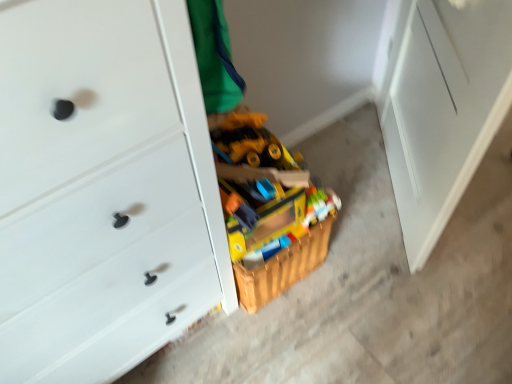
Find the location of a particular element. white matte chest of drawers at center is located at coordinates (103, 189).

This screenshot has width=512, height=384. I want to click on wooden toy box at center, so click(x=268, y=207).

At what (x,y) coordinates should I click in order to perform the action: click on toy below the white matte chest of drawers at center (from a real-world perspective). Please return your answer as a coordinate pair (x, y). Image resolution: width=512 pixels, height=384 pixels. Looking at the image, I should click on (268, 207).

From a real-world perspective, who is located higher, wooden toy box at center or white matte chest of drawers at center?

white matte chest of drawers at center, from a real-world perspective.

Which object is closer to the camera taking this photo, wooden toy box at center or white matte chest of drawers at center?

white matte chest of drawers at center is in front.

Considering the relative sizes of wooden toy box at center and white matte chest of drawers at center in the image provided, is wooden toy box at center shorter than white matte chest of drawers at center?

Indeed, wooden toy box at center has a lesser height compared to white matte chest of drawers at center.

Is white matte file cabinet at right a part of white matte chest of drawers at center?

Definitely not — white matte file cabinet at right is not inside white matte chest of drawers at center.

Between white matte chest of drawers at center and white matte file cabinet at right, which one has larger size?

white matte chest of drawers at center.

Is white matte chest of drawers at center thinner than white matte file cabinet at right?

No, white matte chest of drawers at center is not thinner than white matte file cabinet at right.

Considering the relative positions of white matte chest of drawers at center and white matte file cabinet at right in the image provided, is white matte chest of drawers at center in front of white matte file cabinet at right?

That is True.

How many degrees apart are the facing directions of white matte file cabinet at right and white matte chest of drawers at center?

They differ by 127 degrees in their facing directions.

From the image's perspective, is white matte file cabinet at right beneath white matte chest of drawers at center?

No, from the image's perspective, white matte file cabinet at right is not beneath white matte chest of drawers at center.

In terms of width, does white matte file cabinet at right look wider or thinner when compared to white matte chest of drawers at center?

Considering their sizes, white matte file cabinet at right looks slimmer than white matte chest of drawers at center.

Is white matte file cabinet at right taller or shorter than white matte chest of drawers at center?

Clearly, white matte file cabinet at right is shorter compared to white matte chest of drawers at center.

Does wooden toy box at center turn towards white matte file cabinet at right?

No, wooden toy box at center is not facing towards white matte file cabinet at right.

Which of these two, wooden toy box at center or white matte file cabinet at right, is thinner?

With smaller width is white matte file cabinet at right.

Would you say wooden toy box at center is inside or outside white matte file cabinet at right?

wooden toy box at center lies outside white matte file cabinet at right.

Which of these two, wooden toy box at center or white matte file cabinet at right, is smaller?

white matte file cabinet at right.

Consider the image. Is white matte file cabinet at right next to wooden toy box at center and touching it?

No, white matte file cabinet at right is not touching wooden toy box at center.

Considering the sizes of objects white matte file cabinet at right and wooden toy box at center in the image provided, who is shorter, white matte file cabinet at right or wooden toy box at center?

Standing shorter between the two is wooden toy box at center.

Where is `file cabinet on the right of wooden toy box at center`? Image resolution: width=512 pixels, height=384 pixels. file cabinet on the right of wooden toy box at center is located at coordinates (440, 105).

From the image's perspective, is white matte file cabinet at right positioned above or below wooden toy box at center?

Clearly, from the image's perspective, white matte file cabinet at right is above wooden toy box at center.

Which is in front, white matte chest of drawers at center or wooden toy box at center?

Positioned in front is white matte chest of drawers at center.

From the picture: From a real-world perspective, which object stands above the other?

From a 3D spatial view, white matte chest of drawers at center is above.

Is white matte chest of drawers at center smaller than wooden toy box at center?

Actually, white matte chest of drawers at center might be larger than wooden toy box at center.

Considering the positions of objects white matte chest of drawers at center and wooden toy box at center in the image provided, who is more to the right, white matte chest of drawers at center or wooden toy box at center?

From the viewer's perspective, wooden toy box at center appears more on the right side.

Find the location of a particular element. The width and height of the screenshot is (512, 384). toy below the white matte chest of drawers at center (from the image's perspective) is located at coordinates point(268,207).

The height and width of the screenshot is (384, 512). I want to click on file cabinet that appears on the right of white matte chest of drawers at center, so click(x=440, y=105).

When comparing their distances from wooden toy box at center, does white matte file cabinet at right or white matte chest of drawers at center seem closer?

white matte chest of drawers at center is closer to wooden toy box at center.

Based on their spatial positions, is white matte chest of drawers at center or white matte file cabinet at right closer to wooden toy box at center?

white matte chest of drawers at center is closer to wooden toy box at center.

Looking at this image, when comparing their distances from white matte file cabinet at right, does white matte chest of drawers at center or wooden toy box at center seem closer?

Among the two, wooden toy box at center is located nearer to white matte file cabinet at right.

Considering their positions, is wooden toy box at center positioned further to white matte chest of drawers at center than white matte file cabinet at right?

white matte file cabinet at right lies further to white matte chest of drawers at center than the other object.

Estimate the real-world distances between objects in this image. Which object is closer to white matte chest of drawers at center, white matte file cabinet at right or wooden toy box at center?

wooden toy box at center lies closer to white matte chest of drawers at center than the other object.

From the image, which object appears to be nearer to white matte file cabinet at right, wooden toy box at center or white matte chest of drawers at center?

Based on the image, wooden toy box at center appears to be nearer to white matte file cabinet at right.

At what (x,y) coordinates should I click in order to perform the action: click on toy between white matte chest of drawers at center and white matte file cabinet at right from left to right. Please return your answer as a coordinate pair (x, y). This screenshot has height=384, width=512. Looking at the image, I should click on (268, 207).